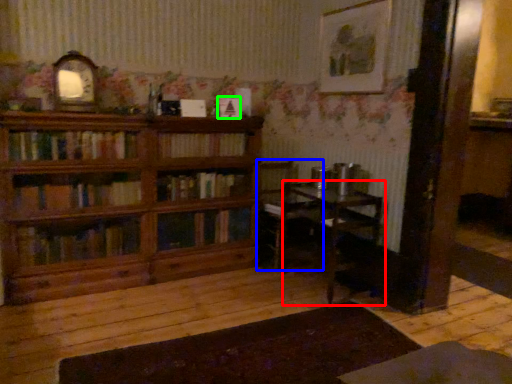
Question: Which object is positioned closest to table (highlighted by a red box)? Select from chair (highlighted by a blue box) and book (highlighted by a green box).

Choices:
 (A) chair
 (B) book

Answer: (A)